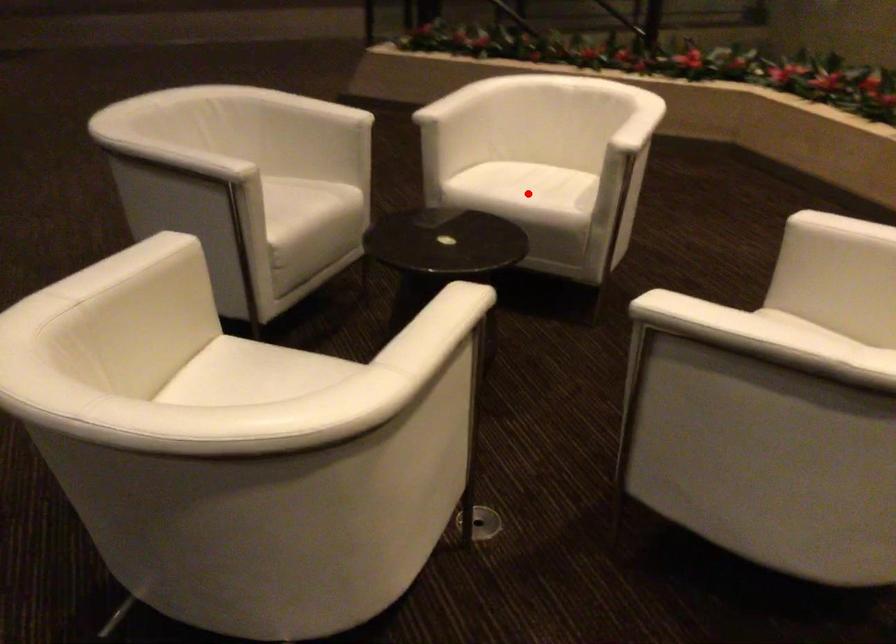
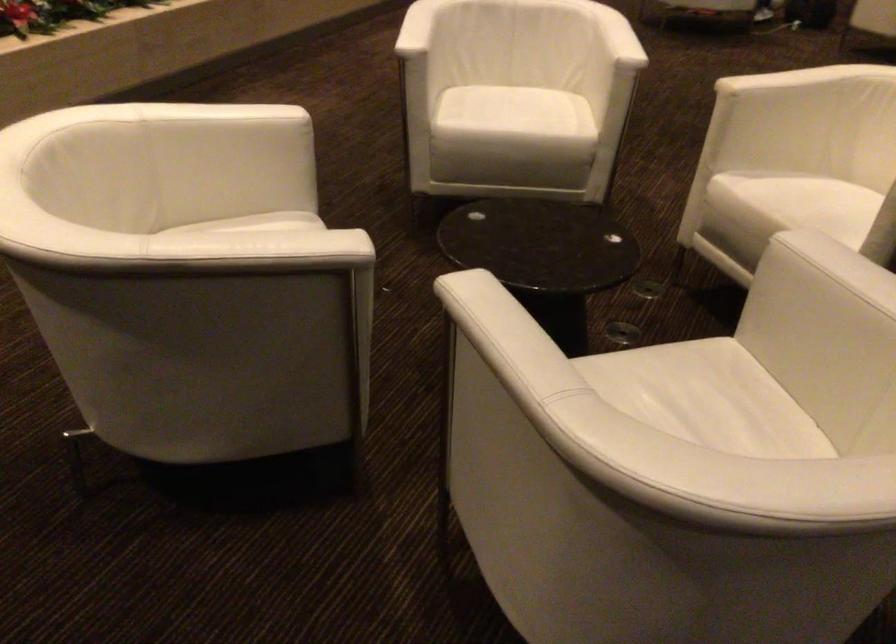
Question: I am providing you with two images of the same scene from different viewpoints. A red point is marked on the first image. Is the red point's position out of view in image 2?

Choices:
 (A) Yes
 (B) No

Answer: (A)